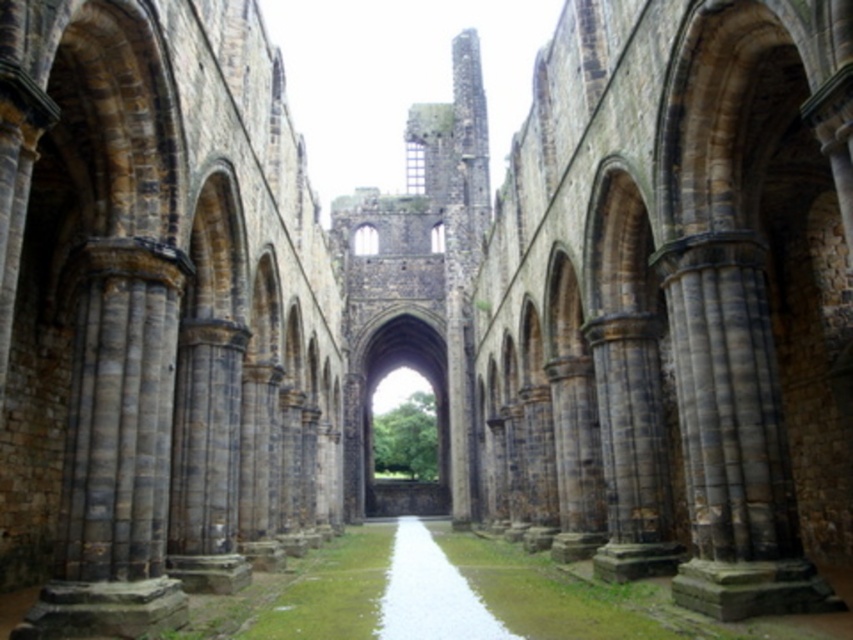
Question: Which of the following is the farthest from the observer?

Choices:
 (A) (412, 328)
 (B) (393, 540)

Answer: (A)

Question: Is stone archway at center thinner than white stone path at center?

Choices:
 (A) yes
 (B) no

Answer: (B)

Question: Is stone archway at center to the right of white stone path at center from the viewer's perspective?

Choices:
 (A) no
 (B) yes

Answer: (A)

Question: Which point is farther to the camera?

Choices:
 (A) stone archway at center
 (B) white stone path at center

Answer: (A)

Question: Can you confirm if stone archway at center is thinner than white stone path at center?

Choices:
 (A) yes
 (B) no

Answer: (B)

Question: Which point is farther from the camera taking this photo?

Choices:
 (A) (428, 372)
 (B) (405, 605)

Answer: (A)